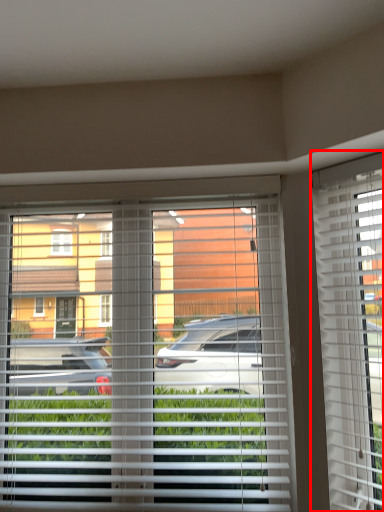
Question: Observing the image, what is the correct spatial positioning of window blind (annotated by the red box) in reference to window blind?

Choices:
 (A) right
 (B) left

Answer: (A)